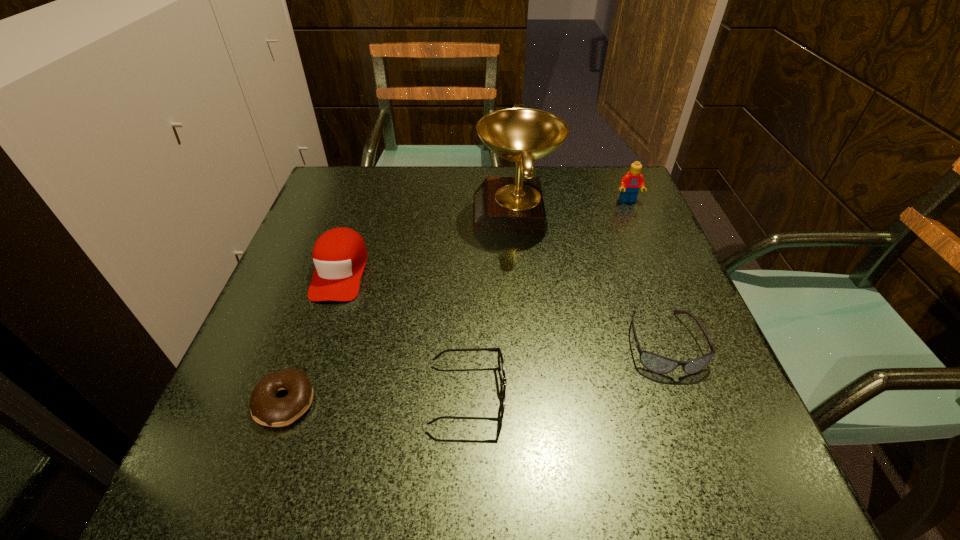
Locate an element on the screen. The height and width of the screenshot is (540, 960). empty space that is in between the sunglasses and the second tallest object is located at coordinates (646, 272).

Locate an element on the screen. This screenshot has height=540, width=960. vacant point located between the shortest object and the baseball cap is located at coordinates (313, 336).

This screenshot has height=540, width=960. In order to click on empty location between the tallest object and the shortest object in this screenshot , I will do click(400, 308).

You are a GUI agent. You are given a task and a screenshot of the screen. Output one action in this format:
    pyautogui.click(x=<x>, y=<y>)
    Task: Click on the vacant point located between the fourth shortest object and the spectacles
    The width and height of the screenshot is (960, 540).
    Given the screenshot: What is the action you would take?
    pyautogui.click(x=404, y=333)

Find the location of a particular element. This screenshot has height=540, width=960. vacant area that lies between the fifth shortest object and the fourth shortest object is located at coordinates (x=484, y=236).

Where is `free space between the sunglasses and the baseball cap`? The image size is (960, 540). free space between the sunglasses and the baseball cap is located at coordinates point(502,307).

I want to click on blank region between the spectacles and the sunglasses, so pos(565,369).

This screenshot has height=540, width=960. Identify the location of vacant area that lies between the tallest object and the spectacles. pyautogui.click(x=492, y=304).

Locate an element on the screen. The image size is (960, 540). object that ranks as the fourth closest to the baseball cap is located at coordinates (658, 364).

You are a GUI agent. You are given a task and a screenshot of the screen. Output one action in this format:
    pyautogui.click(x=<x>, y=<y>)
    Task: Click on the second closest object to the baseball cap
    The width and height of the screenshot is (960, 540).
    Given the screenshot: What is the action you would take?
    pyautogui.click(x=503, y=380)